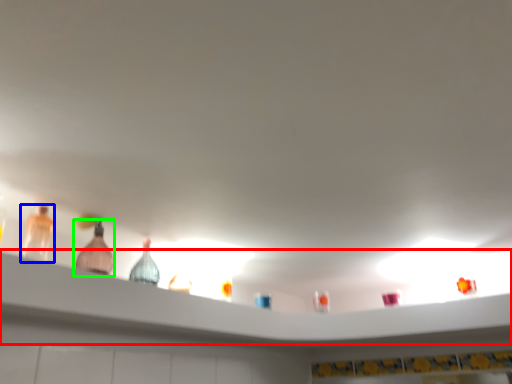
Question: Based on their relative distances, which object is farther from shelf (highlighted by a red box)? Choose from bottle (highlighted by a blue box) and bottle (highlighted by a green box).

Choices:
 (A) bottle
 (B) bottle

Answer: (A)